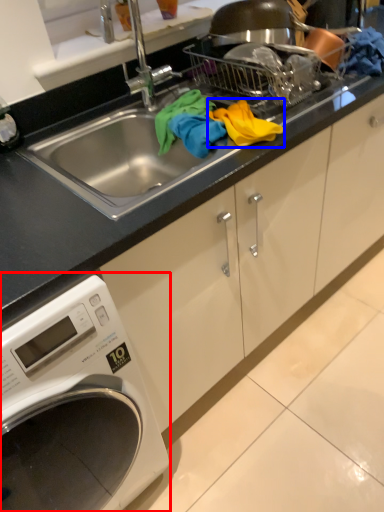
Question: Among these objects, which one is nearest to the camera, washing machine (highlighted by a red box) or material (highlighted by a blue box)?

Choices:
 (A) washing machine
 (B) material

Answer: (A)